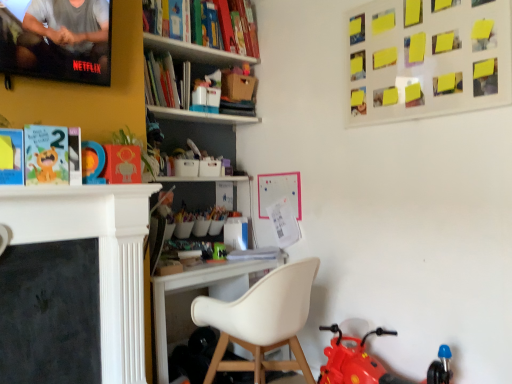
Question: Is matte paper book at left facing away from green plastic toy at center, which ranks as the second toy in right-to-left order?

Choices:
 (A) yes
 (B) no

Answer: (B)

Question: Is matte paper book at left next to green plastic toy at center, marked as the 2th toy in a bottom-to-top arrangement?

Choices:
 (A) yes
 (B) no

Answer: (B)

Question: Is matte paper book at left far from green plastic toy at center, which is the second toy in top-to-bottom order?

Choices:
 (A) yes
 (B) no

Answer: (A)

Question: Is matte paper book at left not inside green plastic toy at center, which ranks as the second toy in right-to-left order?

Choices:
 (A) no
 (B) yes

Answer: (B)

Question: From the image's perspective, is matte paper book at left located beneath green plastic toy at center, which ranks as the second toy in right-to-left order?

Choices:
 (A) no
 (B) yes

Answer: (A)

Question: In terms of height, does white matte chair at center look taller or shorter compared to yellow paper at upper right?

Choices:
 (A) tall
 (B) short

Answer: (A)

Question: From the image's perspective, relative to yellow paper at upper right, is white matte chair at center above or below?

Choices:
 (A) above
 (B) below

Answer: (B)

Question: Looking at the image, does white matte chair at center seem bigger or smaller compared to yellow paper at upper right?

Choices:
 (A) big
 (B) small

Answer: (A)

Question: Considering their positions, is white matte chair at center located in front of or behind yellow paper at upper right?

Choices:
 (A) front
 (B) behind

Answer: (B)

Question: Considering the positions of point (88, 155) and point (59, 145), is point (88, 155) closer or farther from the camera than point (59, 145)?

Choices:
 (A) farther
 (B) closer

Answer: (A)

Question: From a real-world perspective, relative to matte paper book at left, is matte plastic number at center, placed as the 3th toy when sorted from bottom to top, vertically above or below?

Choices:
 (A) above
 (B) below

Answer: (B)

Question: Considering their positions, is matte plastic number at center, the second toy when ordered from back to front, located in front of or behind matte paper book at left?

Choices:
 (A) front
 (B) behind

Answer: (B)

Question: In terms of width, does matte plastic number at center, which appears as the 2th toy when viewed from the front, look wider or thinner when compared to matte paper book at left?

Choices:
 (A) wide
 (B) thin

Answer: (B)

Question: In the image, is matte plastic number at center, placed as the 3th toy when sorted from bottom to top, positioned in front of or behind rubberized red toy motorcycle at lower right, which is the third toy from left to right?

Choices:
 (A) behind
 (B) front

Answer: (A)

Question: Is matte plastic number at center, the third toy positioned from the right, wider or thinner than rubberized red toy motorcycle at lower right, which is counted as the first toy, starting from the front?

Choices:
 (A) thin
 (B) wide

Answer: (A)